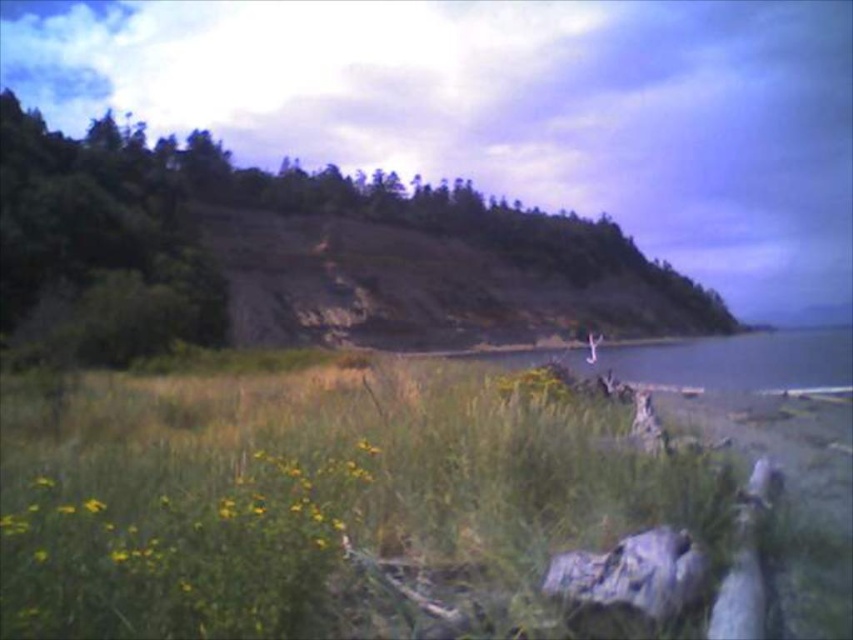
Question: Which object is the closest to the yellow matte flower at lower left?

Choices:
 (A) gray rough rock at lower right
 (B) green grassy at lower center
 (C) green leafy tree at upper center

Answer: (A)

Question: Is green grassy at lower center to the left of green leafy tree at upper center from the viewer's perspective?

Choices:
 (A) yes
 (B) no

Answer: (A)

Question: Can you confirm if green grassy at lower center is positioned to the right of green leafy tree at upper center?

Choices:
 (A) no
 (B) yes

Answer: (A)

Question: Which object is positioned farthest from the green leafy tree at upper center?

Choices:
 (A) green grassy at lower center
 (B) yellow matte flower at lower left
 (C) gray rough rock at lower right

Answer: (B)

Question: Is green grassy at lower center bigger than yellow matte flower at lower left?

Choices:
 (A) no
 (B) yes

Answer: (B)

Question: Which point is closer to the camera?

Choices:
 (A) (260, 627)
 (B) (126, 317)
 (C) (575, 573)

Answer: (A)